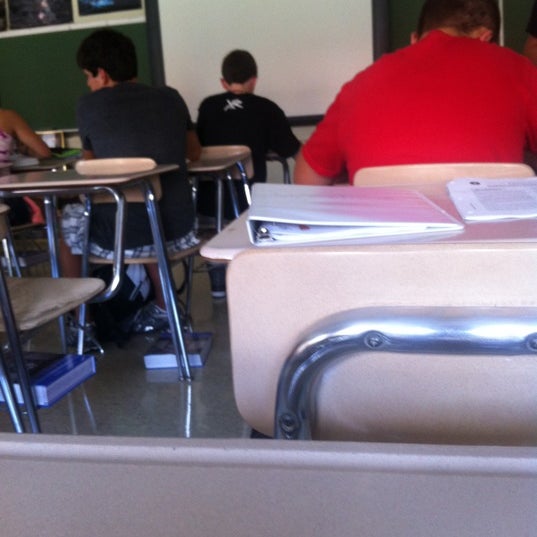
Find the location of a particular element. projector screen is located at coordinates (273, 30).